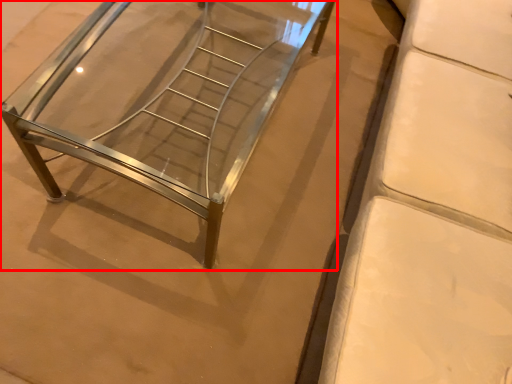
Question: In this image, where is furniture (annotated by the red box) located relative to furniture?

Choices:
 (A) right
 (B) left

Answer: (B)